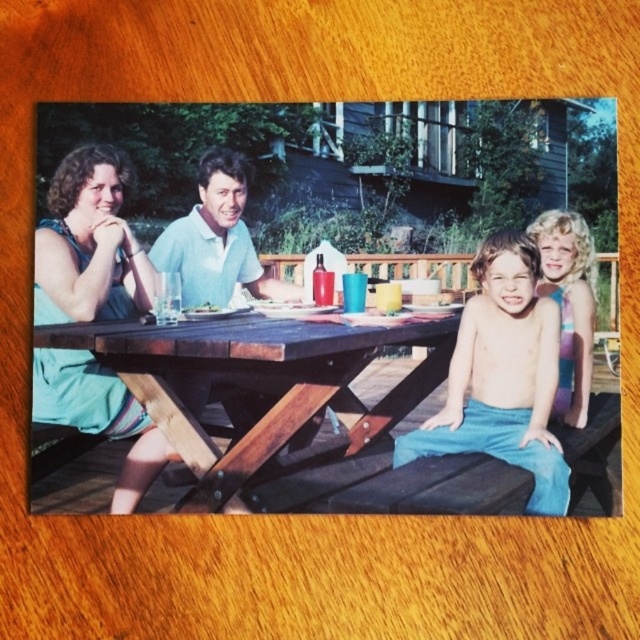
You are a photographer trying to capture a group photo of the family at the wooden picnic table at center and the blonde hair at right. Since you want to include both in the frame, which object should you focus on to ensure both are visible?

The wooden picnic table at center is bigger than the blonde hair at right, so focusing on the wooden picnic table at center will ensure both are visible in the frame.

You are standing behind the wooden picnic table at center and want to hand a napkin to the person wearing the blue denim pants at center. Can you reach them without moving from your current position?

The wooden picnic table at center is further to the viewer than blue denim pants at center, meaning the blue denim pants at center is closer to you. Since you are behind the wooden picnic table at center, you can reach the person wearing the blue denim pants at center without moving because they are in front of the table.

You are standing in front of the wooden picnic table at center and want to hand a napkin to the person with blonde hair at right. Which direction should you move to reach them?

Since the wooden picnic table at center is closer to the viewer than the blonde hair at right, you should move forward towards the blonde hair at right to reach them.